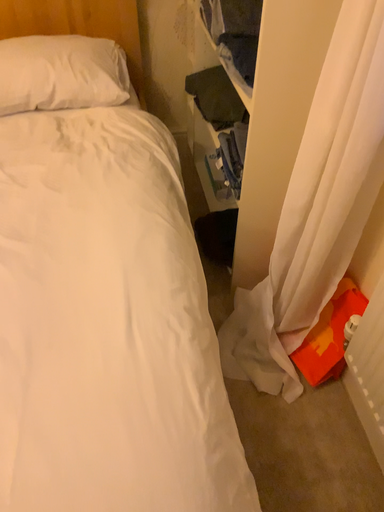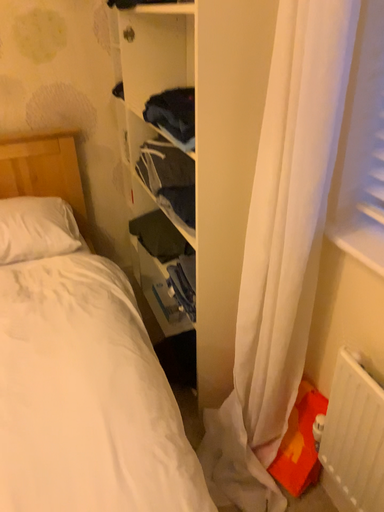
Question: How did the camera likely rotate when shooting the video?

Choices:
 (A) rotated left
 (B) rotated right

Answer: (B)